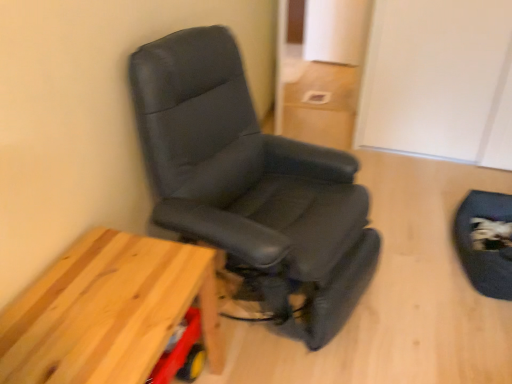
Where is `free space between black leather chair at left and black leather swivel chair at lower right`? The image size is (512, 384). free space between black leather chair at left and black leather swivel chair at lower right is located at coordinates (417, 281).